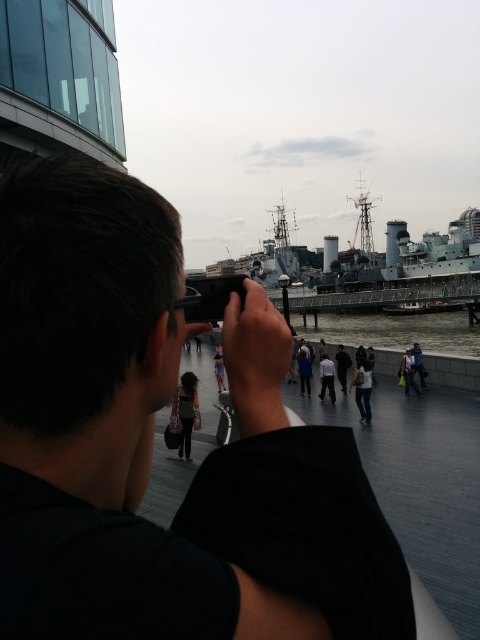
You are a photographer standing behind the silhouette fabric dress at center and the gray metallic battleship at center. Which object is taller?

The gray metallic battleship at center is taller than the silhouette fabric dress at center.

You are standing in the waterfront area near the naval ship. You see the black matte camera at center and the denim jacket at lower right. Which object is positioned to the right side?

The denim jacket at lower right is positioned to the right of the black matte camera at center.